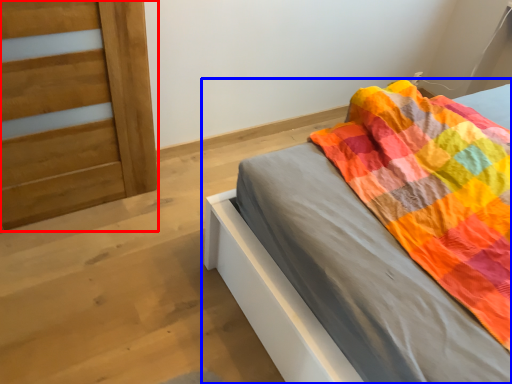
Question: Which object appears closest to the camera in this image, door (highlighted by a red box) or bed (highlighted by a blue box)?

Choices:
 (A) door
 (B) bed

Answer: (B)